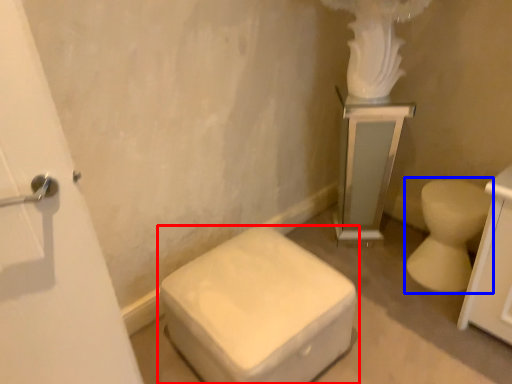
Question: Among these objects, which one is farthest to the camera, toilet (highlighted by a red box) or toilet (highlighted by a blue box)?

Choices:
 (A) toilet
 (B) toilet

Answer: (B)